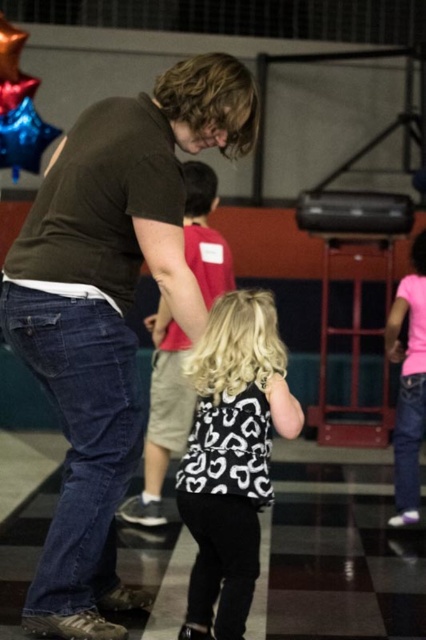
Can you confirm if matte brown shirt at center is positioned to the right of black printed dress at center?

Result: In fact, matte brown shirt at center is to the left of black printed dress at center.

Does matte brown shirt at center have a greater height compared to black printed dress at center?

Correct, matte brown shirt at center is much taller as black printed dress at center.

The image size is (426, 640). What do you see at coordinates (109, 308) in the screenshot?
I see `matte brown shirt at center` at bounding box center [109, 308].

The image size is (426, 640). Identify the location of matte brown shirt at center. (109, 308).

Between black printed dress at center and black matte dress at center, which one has more height?

black printed dress at center is taller.

Which is below, black printed dress at center or black matte dress at center?

Positioned lower is black printed dress at center.

What do you see at coordinates (232, 456) in the screenshot? I see `black printed dress at center` at bounding box center [232, 456].

You are a GUI agent. You are given a task and a screenshot of the screen. Output one action in this format:
    pyautogui.click(x=<x>, y=<y>)
    Task: Click on the black printed dress at center
    This screenshot has width=426, height=640.
    Given the screenshot: What is the action you would take?
    pyautogui.click(x=232, y=456)

In the scene shown: Does matte brown shirt at center have a lesser width compared to black matte dress at center?

No.

Between matte brown shirt at center and black matte dress at center, which one appears on the right side from the viewer's perspective?

black matte dress at center is more to the right.

Is point (112, 557) positioned in front of point (219, 234)?

Yes, point (112, 557) is closer to viewer.

Identify the location of matte brown shirt at center. This screenshot has width=426, height=640. (109, 308).